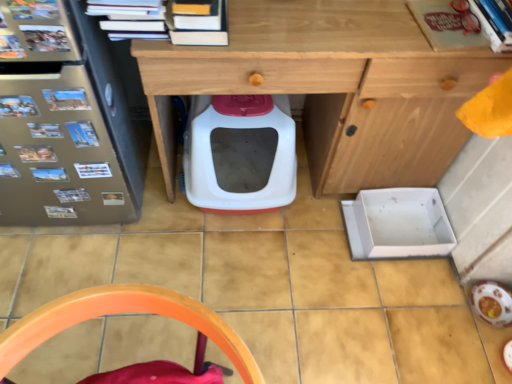
At what (x,y) coordinates should I click in order to perform the action: click on vacant space that's between hardcover books at upper center, the 1th book positioned from the left, and matte red book at upper right, which appears as the 2th book when viewed from the left. Please return your answer as a coordinate pair (x, y). This screenshot has width=512, height=384. Looking at the image, I should click on (324, 26).